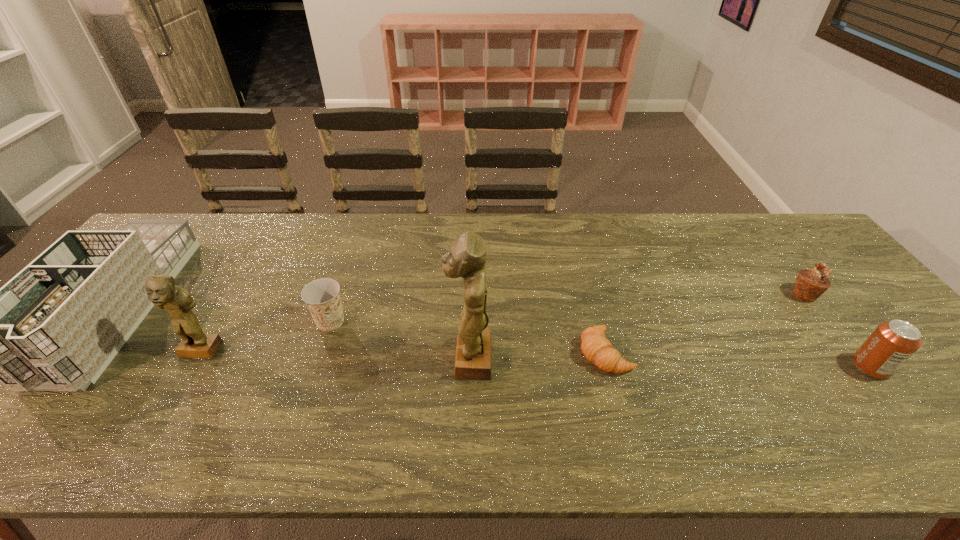
The height and width of the screenshot is (540, 960). I want to click on unoccupied area between the sixth object from right to left and the fifth shortest object, so click(161, 329).

Find the location of a particular element. blank region between the can and the muffin is located at coordinates (837, 330).

Where is `free point between the right figurine and the shorter figurine`? Image resolution: width=960 pixels, height=540 pixels. free point between the right figurine and the shorter figurine is located at coordinates (335, 355).

Where is `free spot between the muffin and the third object from left to right`? This screenshot has width=960, height=540. free spot between the muffin and the third object from left to right is located at coordinates coord(567,308).

Locate an element on the screen. This screenshot has height=540, width=960. empty location between the fifth object from right to left and the muffin is located at coordinates (567, 308).

I want to click on vacant space that is in between the muffin and the third object from right to left, so click(x=705, y=323).

Image resolution: width=960 pixels, height=540 pixels. Identify the location of empty location between the Dixie cup and the muffin. (567, 308).

You are a GUI agent. You are given a task and a screenshot of the screen. Output one action in this format:
    pyautogui.click(x=<x>, y=<y>)
    Task: Click on the empty space that is in between the sixth object from right to left and the fifth object from left to right
    The image size is (960, 540).
    Given the screenshot: What is the action you would take?
    pyautogui.click(x=403, y=352)

Locate an element on the screen. free space between the third object from right to left and the tallest object is located at coordinates (538, 355).

Locate an element on the screen. This screenshot has width=960, height=540. unoccupied area between the second object from left to right and the muffin is located at coordinates (502, 323).